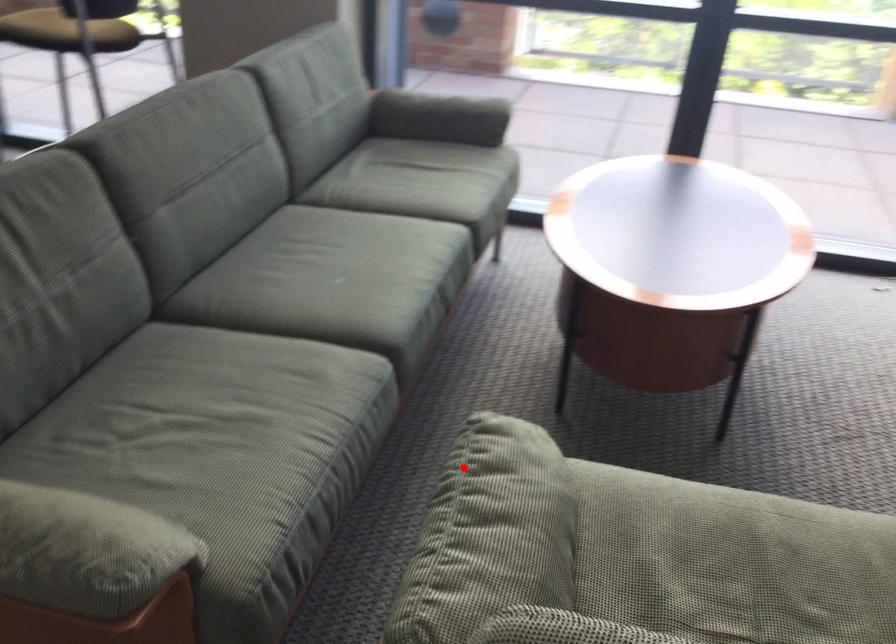
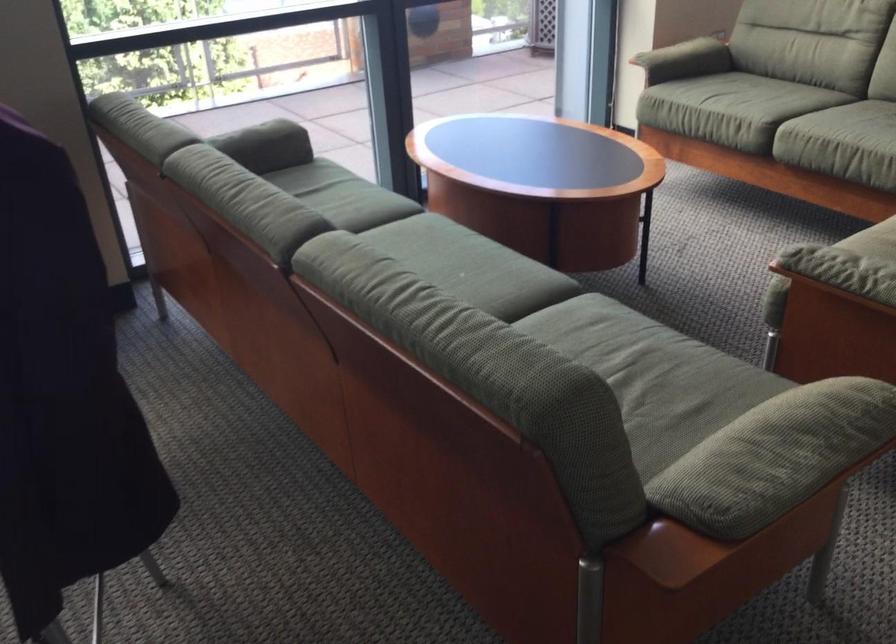
The point at the highlighted location is marked in the first image. Where is the corresponding point in the second image?

(834, 263)